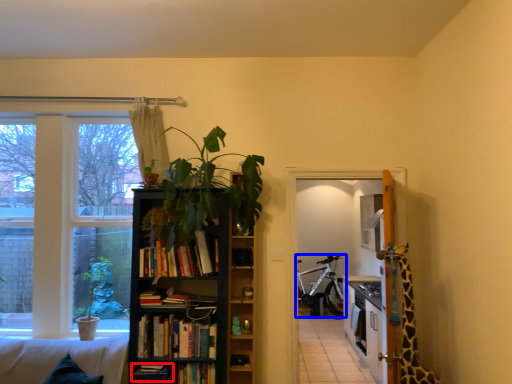
Question: Which of the following is the farthest to the observer, book (highlighted by a red box) or bicycle (highlighted by a blue box)?

Choices:
 (A) book
 (B) bicycle

Answer: (B)